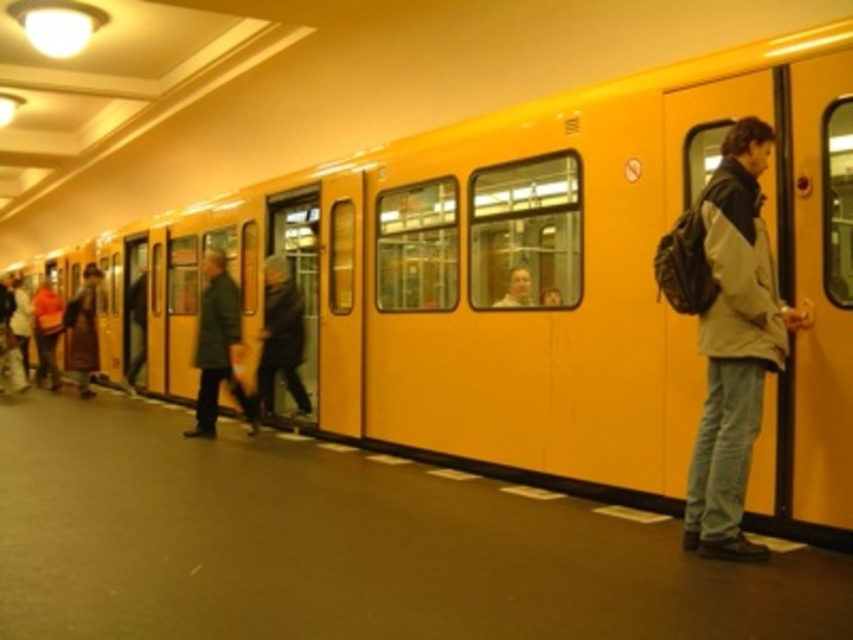
Is point (729, 348) positioned after point (215, 252)?

That is False.

Does matte gray jacket at right have a lesser width compared to green wool coat at center?

Yes, matte gray jacket at right is thinner than green wool coat at center.

The image size is (853, 640). I want to click on matte gray jacket at right, so click(x=734, y=342).

Does matte gray jacket at right have a larger size compared to dark brown leather jacket at center?

Actually, matte gray jacket at right might be smaller than dark brown leather jacket at center.

Can you confirm if matte gray jacket at right is wider than dark brown leather jacket at center?

No.

Where is `matte gray jacket at right`? matte gray jacket at right is located at coordinates (734, 342).

This screenshot has height=640, width=853. I want to click on matte gray jacket at right, so click(x=734, y=342).

Which is above, green wool coat at center or dark brown leather jacket at center?

dark brown leather jacket at center is higher up.

Locate an element on the screen. The width and height of the screenshot is (853, 640). green wool coat at center is located at coordinates (218, 346).

Find the location of a particular element. green wool coat at center is located at coordinates (218, 346).